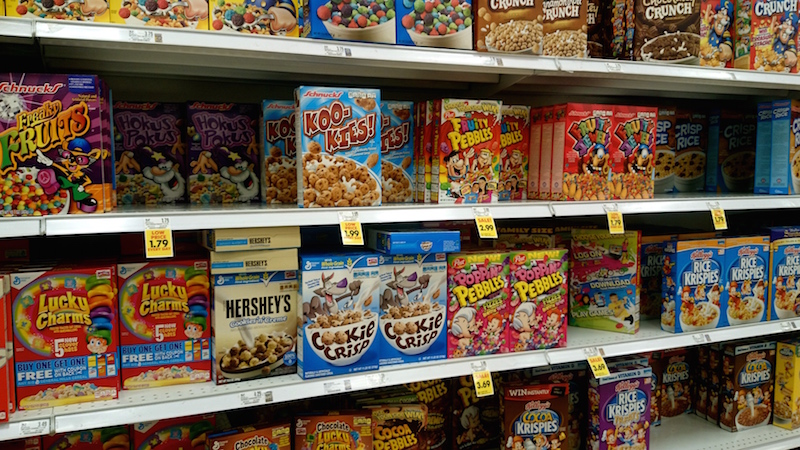
Find the location of a particular element. This screenshot has height=450, width=800. shelves is located at coordinates (689, 445), (680, 346), (666, 214), (648, 62).